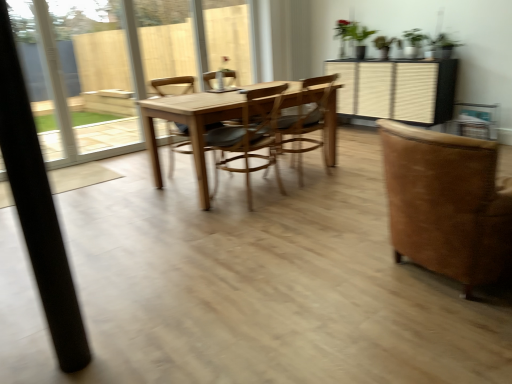
The width and height of the screenshot is (512, 384). What do you see at coordinates (352, 31) in the screenshot?
I see `green matte plant at upper center` at bounding box center [352, 31].

Measure the distance between point (326,167) and camera.

A distance of 3.83 meters exists between point (326,167) and camera.

This screenshot has height=384, width=512. I want to click on black matte pole at left, so click(38, 208).

This screenshot has height=384, width=512. Describe the element at coordinates (38, 208) in the screenshot. I see `black matte pole at left` at that location.

What are the coordinates of `green matte plant at upper center` in the screenshot? It's located at (352, 31).

Is brown suede chair at right, the fourth chair from the left, at the back of wooden chair at center, the 4th chair in the right-to-left sequence?

No, brown suede chair at right, the fourth chair from the left, is not at the back of wooden chair at center, the 4th chair in the right-to-left sequence.

Considering the sizes of wooden chair at center, the 4th chair in the right-to-left sequence, and brown suede chair at right, the fourth chair from the left, in the image, is wooden chair at center, the 4th chair in the right-to-left sequence, taller or shorter than brown suede chair at right, the fourth chair from the left,?

Considering their sizes, wooden chair at center, the 4th chair in the right-to-left sequence, has more height than brown suede chair at right, the fourth chair from the left.

Could you measure the distance between wooden chair at center, positioned as the first chair in left-to-right order, and brown suede chair at right, which ranks as the first chair in right-to-left order?

The distance of wooden chair at center, positioned as the first chair in left-to-right order, from brown suede chair at right, which ranks as the first chair in right-to-left order, is 8.50 feet.

Is brown suede chair at right, which ranks as the first chair in right-to-left order, further to camera compared to wooden chair at center, the 4th chair in the right-to-left sequence?

No.

From the wooden chair at center, positioned as the first chair in left-to-right order, count 3rd chairs forward and point to it. Please provide its 2D coordinates.

[(447, 203)]

Which object is thinner, brown suede chair at right, the fourth chair from the left, or wooden chair at center, positioned as the first chair in left-to-right order?

Thinner between the two is wooden chair at center, positioned as the first chair in left-to-right order.

Who is bigger, brown suede chair at right, which ranks as the first chair in right-to-left order, or wooden chair at center, positioned as the first chair in left-to-right order?

With larger size is brown suede chair at right, which ranks as the first chair in right-to-left order.

From a real-world perspective, relative to black matte pole at left, is green matte plant at upper center vertically above or below?

green matte plant at upper center is above black matte pole at left.

Is green matte plant at upper center to the right of black matte pole at left from the viewer's perspective?

Indeed, green matte plant at upper center is positioned on the right side of black matte pole at left.

Is point (504, 240) closer to camera compared to point (311, 90)?

Yes.

Which of these two, brown suede chair at right, which ranks as the first chair in right-to-left order, or wooden chair at center, the 2th chair viewed from the right, is wider?

brown suede chair at right, which ranks as the first chair in right-to-left order, is wider.

Considering the sizes of objects brown suede chair at right, which ranks as the first chair in right-to-left order, and wooden chair at center, the 2th chair viewed from the right, in the image provided, who is smaller, brown suede chair at right, which ranks as the first chair in right-to-left order, or wooden chair at center, the 2th chair viewed from the right,?

With smaller size is wooden chair at center, the 2th chair viewed from the right.

From the image's perspective, would you say brown suede chair at right, which ranks as the first chair in right-to-left order, is shown under wooden chair at center, which ranks as the 3th chair in left-to-right order?

Indeed, from the image's perspective, brown suede chair at right, which ranks as the first chair in right-to-left order, is shown beneath wooden chair at center, which ranks as the 3th chair in left-to-right order.

Is wooden chair at center, positioned as the first chair in left-to-right order, to the right of wooden at center, arranged as the 2th chair when viewed from the left, from the viewer's perspective?

Incorrect, wooden chair at center, positioned as the first chair in left-to-right order, is not on the right side of wooden at center, arranged as the 2th chair when viewed from the left.

Is wooden chair at center, the 4th chair in the right-to-left sequence, taller or shorter than wooden at center, arranged as the 2th chair when viewed from the left?

Considering their sizes, wooden chair at center, the 4th chair in the right-to-left sequence, has more height than wooden at center, arranged as the 2th chair when viewed from the left.

From a real-world perspective, which is physically below, wooden chair at center, positioned as the first chair in left-to-right order, or wooden at center, arranged as the 2th chair when viewed from the left?

From a 3D spatial view, wooden at center, arranged as the 2th chair when viewed from the left, is below.

Does point (13, 97) appear closer or farther from the camera than point (289, 121)?

Point (13, 97) appears to be closer to the viewer than point (289, 121).

Is black matte pole at left positioned far away from wooden chair at center, the 2th chair viewed from the right?

black matte pole at left is far away from wooden chair at center, the 2th chair viewed from the right.

Where is `the 3rd chair behind the black matte pole at left`? The image size is (512, 384). the 3rd chair behind the black matte pole at left is located at coordinates (306, 122).

Is black matte pole at left taller or shorter than wooden chair at center, the 2th chair viewed from the right?

Considering their sizes, black matte pole at left has more height than wooden chair at center, the 2th chair viewed from the right.

Is green matte plant at upper center not near wooden at center, arranged as the 2th chair when viewed from the left?

Yes, green matte plant at upper center and wooden at center, arranged as the 2th chair when viewed from the left, are located far from each other.

Which object is positioned more to the left, green matte plant at upper center or wooden at center, arranged as the 2th chair when viewed from the left?

From the viewer's perspective, wooden at center, arranged as the 2th chair when viewed from the left, appears more on the left side.

Could you tell me if green matte plant at upper center is turned towards wooden at center, arranged as the 2th chair when viewed from the left?

Yes, green matte plant at upper center is facing wooden at center, arranged as the 2th chair when viewed from the left.

From the image's perspective, is green matte plant at upper center under wooden at center, which is the 3th chair in right-to-left order?

No.

Starting from the brown suede chair at right, which ranks as the first chair in right-to-left order, which chair is the 3rd one behind? Please provide its 2D coordinates.

[(176, 143)]

I want to click on chair that is the 3rd one when counting leftward from the brown suede chair at right, the fourth chair from the left, so click(176, 143).

Considering their positions, is green matte plant at upper center positioned further to wooden chair at center, the 4th chair in the right-to-left sequence, than wooden chair at center, which ranks as the 3th chair in left-to-right order?

green matte plant at upper center is further to wooden chair at center, the 4th chair in the right-to-left sequence.

From the image, which object appears to be farther from wooden at center, arranged as the 2th chair when viewed from the left, black matte pole at left or green matte plant at upper center?

green matte plant at upper center is positioned further to the anchor wooden at center, arranged as the 2th chair when viewed from the left.

Looking at the image, which one is located closer to wooden chair at center, the 4th chair in the right-to-left sequence, wooden chair at center, the 2th chair viewed from the right, or brown suede chair at right, which ranks as the first chair in right-to-left order?

Based on the image, wooden chair at center, the 2th chair viewed from the right, appears to be nearer to wooden chair at center, the 4th chair in the right-to-left sequence.

When comparing their distances from wooden at center, which is the 3th chair in right-to-left order, does green matte plant at upper center or brown suede chair at right, which ranks as the first chair in right-to-left order, seem closer?

Based on the image, brown suede chair at right, which ranks as the first chair in right-to-left order, appears to be nearer to wooden at center, which is the 3th chair in right-to-left order.

Estimate the real-world distances between objects in this image. Which object is closer to brown suede chair at right, the fourth chair from the left, wooden chair at center, which ranks as the 3th chair in left-to-right order, or green matte plant at upper center?

The object closer to brown suede chair at right, the fourth chair from the left, is wooden chair at center, which ranks as the 3th chair in left-to-right order.

Considering their positions, is brown suede chair at right, the fourth chair from the left, positioned closer to wooden chair at center, which ranks as the 3th chair in left-to-right order, than green matte plant at upper center?

brown suede chair at right, the fourth chair from the left, is positioned closer to the anchor wooden chair at center, which ranks as the 3th chair in left-to-right order.

Looking at the image, which one is located further to green matte plant at upper center, wooden chair at center, the 2th chair viewed from the right, or black matte pole at left?

black matte pole at left is positioned further to the anchor green matte plant at upper center.

Based on their spatial positions, is wooden at center, arranged as the 2th chair when viewed from the left, or brown suede chair at right, the fourth chair from the left, closer to black matte pole at left?

brown suede chair at right, the fourth chair from the left, is positioned closer to the anchor black matte pole at left.

Identify the location of chair between wooden chair at center, positioned as the first chair in left-to-right order, and wooden chair at center, the 2th chair viewed from the right, from left to right. (250, 137).

You are a GUI agent. You are given a task and a screenshot of the screen. Output one action in this format:
    pyautogui.click(x=<x>, y=<y>)
    Task: Click on the chair between brown suede chair at right, which ranks as the first chair in right-to-left order, and wooden chair at center, the 2th chair viewed from the right, from front to back
    
    Given the screenshot: What is the action you would take?
    pyautogui.click(x=250, y=137)